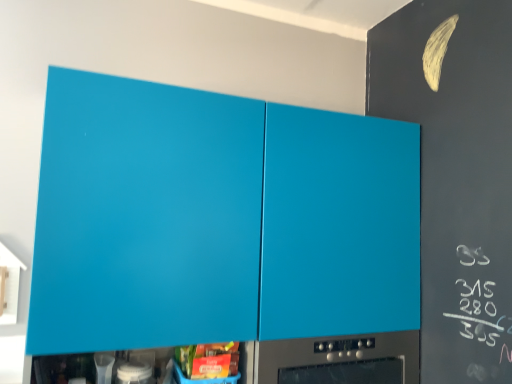
Image resolution: width=512 pixels, height=384 pixels. What do you see at coordinates (208, 360) in the screenshot?
I see `matte plastic container at lower center` at bounding box center [208, 360].

Describe the element at coordinates (134, 372) in the screenshot. The width and height of the screenshot is (512, 384). I see `white glossy container at lower center` at that location.

Where is `matte plastic container at lower center`? The height and width of the screenshot is (384, 512). matte plastic container at lower center is located at coordinates (208, 360).

From a real-world perspective, is matte blue cabinet at upper center over white glossy container at lower center?

Correct, in the physical world, matte blue cabinet at upper center is higher than white glossy container at lower center.

Is point (254, 206) in front of point (117, 371)?

No.

Is matte blue cabinet at upper center far from white glossy container at lower center?

No, matte blue cabinet at upper center is in close proximity to white glossy container at lower center.

Is matte blue cabinet at upper center aimed at white glossy container at lower center?

Yes, matte blue cabinet at upper center faces towards white glossy container at lower center.

Based on the photo, visually, is white glossy container at lower center positioned to the left or to the right of matte blue cabinet at upper center?

Based on their positions, white glossy container at lower center is located to the left of matte blue cabinet at upper center.

Which object is wider, white glossy container at lower center or matte blue cabinet at upper center?

With larger width is matte blue cabinet at upper center.

Considering the sizes of objects white glossy container at lower center and matte blue cabinet at upper center in the image provided, who is taller, white glossy container at lower center or matte blue cabinet at upper center?

Standing taller between the two is matte blue cabinet at upper center.

This screenshot has height=384, width=512. I want to click on appliance behind the matte blue cabinet at upper center, so click(x=134, y=372).

Considering the points (215, 353) and (312, 352), which point is behind, point (215, 353) or point (312, 352)?

Point (312, 352)

Which of these two, matte plastic container at lower center or satin black oven at lower center, is wider?

With larger width is satin black oven at lower center.

Considering the sizes of matte plastic container at lower center and satin black oven at lower center in the image, is matte plastic container at lower center taller or shorter than satin black oven at lower center?

Considering their sizes, matte plastic container at lower center has less height than satin black oven at lower center.

Can you confirm if matte plastic container at lower center is smaller than satin black oven at lower center?

Yes, matte plastic container at lower center is smaller than satin black oven at lower center.

Which is in front, matte plastic container at lower center or white glossy container at lower center?

white glossy container at lower center is more forward.

Does point (234, 356) come farther from viewer compared to point (130, 380)?

Yes, it is.

In the image, is matte plastic container at lower center on the left side or the right side of white glossy container at lower center?

Clearly, matte plastic container at lower center is on the right of white glossy container at lower center in the image.

From the picture: Would you say matte plastic container at lower center is a long distance from white glossy container at lower center?

No, matte plastic container at lower center is in close proximity to white glossy container at lower center.

Considering the relative sizes of matte plastic container at lower center and matte blue cabinet at upper center in the image provided, is matte plastic container at lower center taller than matte blue cabinet at upper center?

No, matte plastic container at lower center is not taller than matte blue cabinet at upper center.

Locate an element on the screen. This screenshot has height=384, width=512. food below the matte blue cabinet at upper center (from a real-world perspective) is located at coordinates click(x=208, y=360).

In terms of width, does matte plastic container at lower center look wider or thinner when compared to matte blue cabinet at upper center?

In the image, matte plastic container at lower center appears to be more narrow than matte blue cabinet at upper center.

From the image's perspective, is matte plastic container at lower center beneath matte blue cabinet at upper center?

Yes, from the image's perspective, matte plastic container at lower center is below matte blue cabinet at upper center.

Considering the sizes of objects white glossy container at lower center and matte plastic container at lower center in the image provided, who is smaller, white glossy container at lower center or matte plastic container at lower center?

With smaller size is white glossy container at lower center.

Is white glossy container at lower center thinner than matte plastic container at lower center?

Correct, the width of white glossy container at lower center is less than that of matte plastic container at lower center.

Can you confirm if white glossy container at lower center is positioned to the right of matte plastic container at lower center?

No, white glossy container at lower center is not to the right of matte plastic container at lower center.

From the image's perspective, is white glossy container at lower center under matte plastic container at lower center?

No.

Is matte blue cabinet at upper center bigger than satin black oven at lower center?

Indeed, matte blue cabinet at upper center has a larger size compared to satin black oven at lower center.

Which is closer to the camera, (185,309) or (275,370)?

Point (185,309) is positioned closer to the camera compared to point (275,370).

Considering the relative sizes of matte blue cabinet at upper center and satin black oven at lower center in the image provided, is matte blue cabinet at upper center thinner than satin black oven at lower center?

Yes.

From the image's perspective, is matte blue cabinet at upper center located above satin black oven at lower center?

Yes, from the image's perspective, matte blue cabinet at upper center is over satin black oven at lower center.

Where is `cabinetry positioned vertically above the white glossy container at lower center (from a real-world perspective)`? The height and width of the screenshot is (384, 512). cabinetry positioned vertically above the white glossy container at lower center (from a real-world perspective) is located at coordinates (217, 219).

Identify the location of appliance that is under the matte blue cabinet at upper center (from a real-world perspective). (134, 372).

From the image, which object appears to be nearer to matte plastic container at lower center, satin black oven at lower center or white glossy container at lower center?

white glossy container at lower center is closer to matte plastic container at lower center.

Which object lies further to the anchor point matte blue cabinet at upper center, matte plastic container at lower center or satin black oven at lower center?

matte plastic container at lower center is positioned further to the anchor matte blue cabinet at upper center.

From the image, which object appears to be nearer to matte plastic container at lower center, matte blue cabinet at upper center or white glossy container at lower center?

white glossy container at lower center is closer to matte plastic container at lower center.

Based on their spatial positions, is white glossy container at lower center or satin black oven at lower center closer to matte blue cabinet at upper center?

satin black oven at lower center.

When comparing their distances from satin black oven at lower center, does matte blue cabinet at upper center or white glossy container at lower center seem closer?

Based on the image, matte blue cabinet at upper center appears to be nearer to satin black oven at lower center.

Which object lies further to the anchor point white glossy container at lower center, matte blue cabinet at upper center or matte plastic container at lower center?

Among the two, matte blue cabinet at upper center is located further to white glossy container at lower center.

Which object lies further to the anchor point matte blue cabinet at upper center, satin black oven at lower center or matte plastic container at lower center?

The object further to matte blue cabinet at upper center is matte plastic container at lower center.

Estimate the real-world distances between objects in this image. Which object is further from matte plastic container at lower center, matte blue cabinet at upper center or satin black oven at lower center?

matte blue cabinet at upper center.

The image size is (512, 384). Find the location of `food situated between white glossy container at lower center and satin black oven at lower center from left to right`. food situated between white glossy container at lower center and satin black oven at lower center from left to right is located at coordinates (208, 360).

Locate an element on the screen. This screenshot has width=512, height=384. cabinetry located between white glossy container at lower center and satin black oven at lower center in the left-right direction is located at coordinates (217, 219).

Locate an element on the screen. The width and height of the screenshot is (512, 384). appliance between matte blue cabinet at upper center and matte plastic container at lower center in the vertical direction is located at coordinates (134, 372).

Where is `food between matte blue cabinet at upper center and satin black oven at lower center in the up-down direction`? The image size is (512, 384). food between matte blue cabinet at upper center and satin black oven at lower center in the up-down direction is located at coordinates (208, 360).